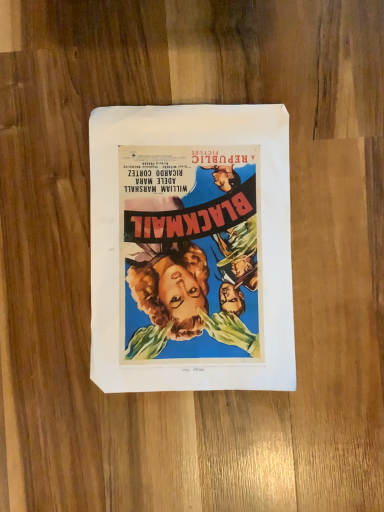
Find the location of `vacant space situated above matte paper poster at center (from a real-world perspective)`. vacant space situated above matte paper poster at center (from a real-world perspective) is located at coordinates (188, 248).